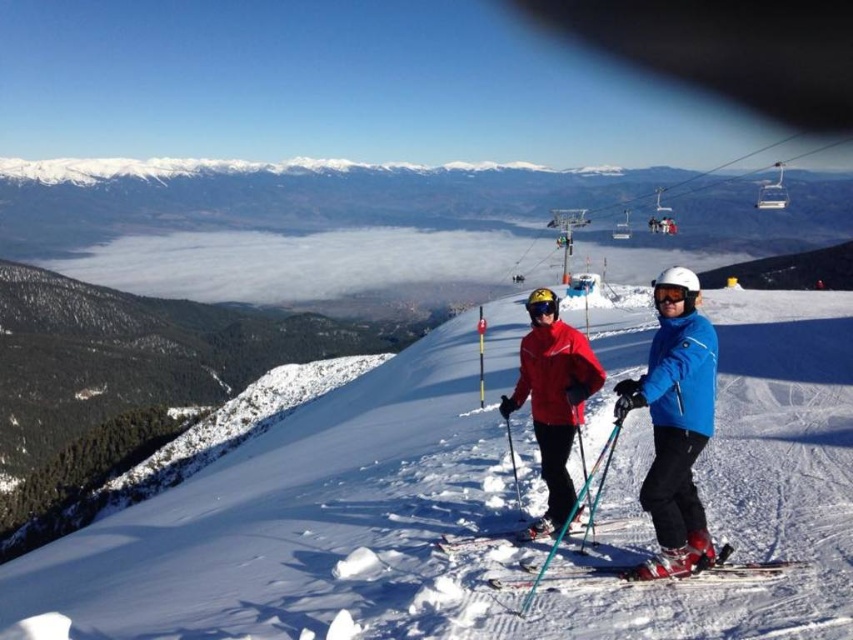
Question: Does blue matte ski jacket at right have a larger size compared to matte red ski jacket at center?

Choices:
 (A) no
 (B) yes

Answer: (B)

Question: Which object appears closest to the camera in this image?

Choices:
 (A) matte red ski jacket at center
 (B) white snow ski slope at center

Answer: (B)

Question: Is matte red ski jacket at center to the right of white matte goggles at center from the viewer's perspective?

Choices:
 (A) no
 (B) yes

Answer: (A)

Question: Observing the image, what is the correct spatial positioning of matte blue jacket at center in reference to white matte goggles at center?

Choices:
 (A) right
 (B) left

Answer: (A)

Question: Which object is farther from the camera taking this photo?

Choices:
 (A) matte blue jacket at center
 (B) black matte goggles at center
 (C) blue matte ski jacket at right
 (D) shiny metallic ski at center

Answer: (B)

Question: Which of these objects is positioned closest to the white snow ski slope at center?

Choices:
 (A) shiny metallic ski at center
 (B) shiny red ski at center

Answer: (A)